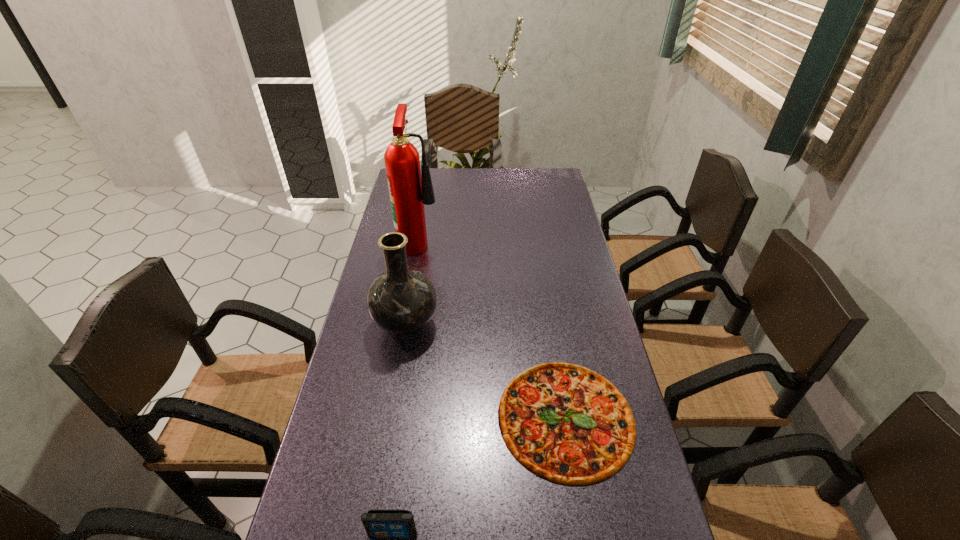
Image resolution: width=960 pixels, height=540 pixels. In order to click on free point between the rightmost object and the tallest object in this screenshot , I will do `click(492, 329)`.

The width and height of the screenshot is (960, 540). Identify the location of free space that is in between the iPod and the third nearest object. (399, 429).

Where is `empty location between the nearest object and the farthest object`? The height and width of the screenshot is (540, 960). empty location between the nearest object and the farthest object is located at coordinates (406, 388).

The image size is (960, 540). I want to click on the third closest object to the second shortest object, so click(410, 186).

Select which object appears as the closest to the second shortest object. Please provide its 2D coordinates. Your answer should be formatted as a tuple, i.e. [(x, y)], where the tuple contains the x and y coordinates of a point satisfying the conditions above.

[(566, 423)]

This screenshot has height=540, width=960. Find the location of `vacant position in the image that satisfies the following two spatial constraints: 1. at the nozzle of the tallest object; 2. on the back side of the pizza`. vacant position in the image that satisfies the following two spatial constraints: 1. at the nozzle of the tallest object; 2. on the back side of the pizza is located at coordinates (389, 417).

Find the location of `vacant space that satisfies the following two spatial constraints: 1. at the nozzle of the tallest object; 2. on the back side of the second tallest object`. vacant space that satisfies the following two spatial constraints: 1. at the nozzle of the tallest object; 2. on the back side of the second tallest object is located at coordinates 405,324.